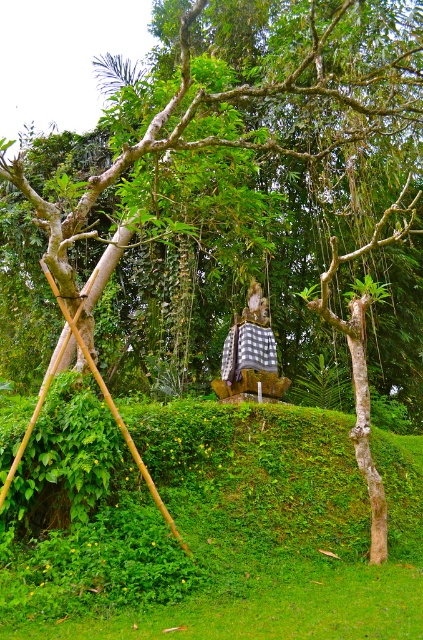
Question: Can you confirm if green grassy at center is positioned to the right of checkered fabric statue at center?

Choices:
 (A) yes
 (B) no

Answer: (B)

Question: Does green grassy at center have a lesser width compared to checkered fabric statue at center?

Choices:
 (A) yes
 (B) no

Answer: (B)

Question: In this image, where is green grassy at center located relative to checkered fabric statue at center?

Choices:
 (A) right
 (B) left

Answer: (B)